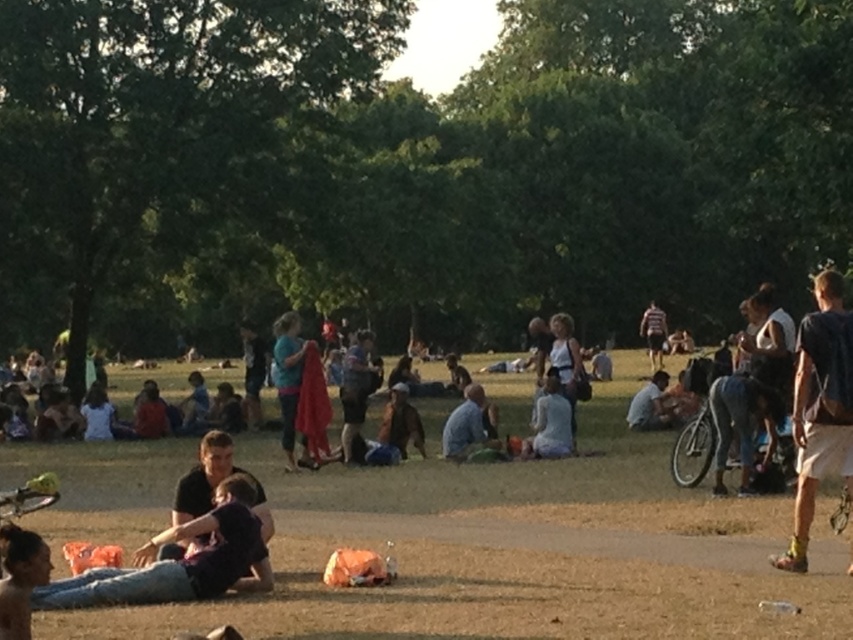
You are a photographer trying to capture a shot of the blue fabric at center and the blue denim shirt at center in the park scene. Which object should you focus on first if you want to include both in your frame without adjusting your camera angle?

The blue fabric at center is taller than the blue denim shirt at center, so you should focus on the blue fabric at center first to ensure it fits within the frame.

You are a photographer taking a picture of the dark blue shirt at lower left and the dark brown hair at lower left in the park scene. Which object will appear bigger in your photo?

The dark blue shirt at lower left will appear bigger in the photo because it is larger in size than the dark brown hair at lower left.